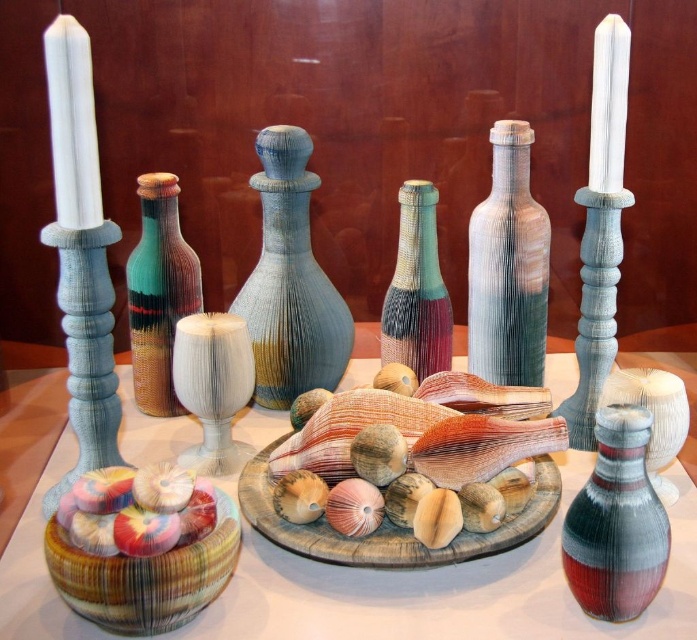
Consider the image. You are standing in front of the display of ceramic items. There are two points marked on the arrangement. The first point is at coordinates point (183, 346) and the second is at point (654, 484). Which point is closer to you?

Point (183, 346) is closer to you than point (654, 484) because it is further to the viewer according to the description.

You are standing in front of the display table with the ceramic items. There are two points marked on the table surface. The first point is located at coordinates point (273, 132), and the second point is at point (569, 572). Which point is closer to you?

Point (273, 132) is closer to you because it is further to the viewer than point (569, 572).

You are an interior designer planning to place a tall plant next to the textured blue vase at center and the striped fabric vase at center. Which vase should the plant be placed next to if you want it to complement the height of the plant?

The textured blue vase at center is much taller than the striped fabric vase at center, so placing the plant next to the taller vase would create a harmonious height complement.